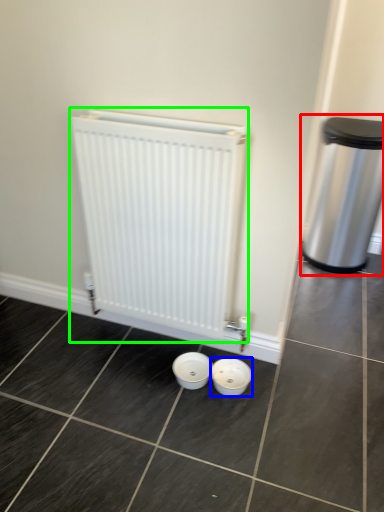
Question: Which is farther away from waste container (highlighted by a red box)? basin (highlighted by a blue box) or radiator (highlighted by a green box)?

Choices:
 (A) basin
 (B) radiator

Answer: (A)